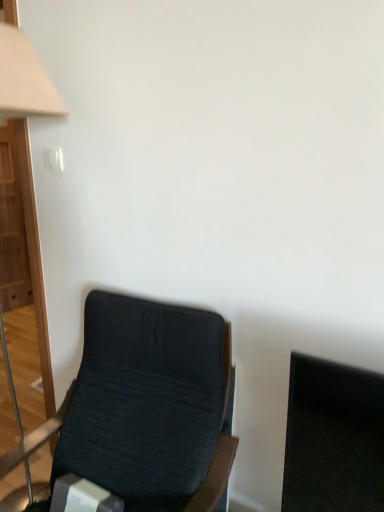
Question: Considering their positions, is dark fabric chair at lower left located in front of or behind beige fabric lampshade at left?

Choices:
 (A) front
 (B) behind

Answer: (A)

Question: In terms of size, does dark fabric chair at lower left appear bigger or smaller than beige fabric lampshade at left?

Choices:
 (A) small
 (B) big

Answer: (B)

Question: Do you think dark fabric chair at lower left is within beige fabric lampshade at left, or outside of it?

Choices:
 (A) outside
 (B) inside

Answer: (A)

Question: Is beige fabric lampshade at left inside the boundaries of dark fabric chair at lower left, or outside?

Choices:
 (A) inside
 (B) outside

Answer: (B)

Question: From a real-world perspective, relative to dark fabric chair at lower left, is beige fabric lampshade at left vertically above or below?

Choices:
 (A) above
 (B) below

Answer: (A)

Question: Based on their positions, is beige fabric lampshade at left located to the left or right of dark fabric chair at lower left?

Choices:
 (A) right
 (B) left

Answer: (B)

Question: Is beige fabric lampshade at left taller or shorter than dark fabric chair at lower left?

Choices:
 (A) tall
 (B) short

Answer: (A)